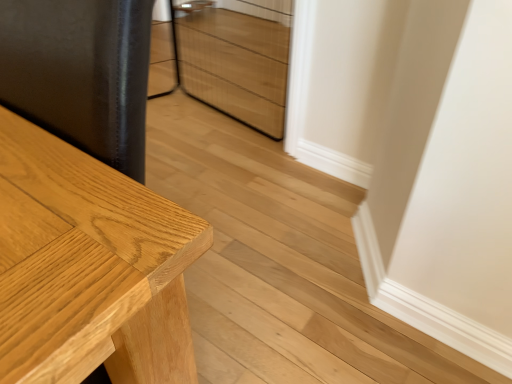
Identify the location of free spot below wooden drawer at center (from a real-world perspective). The width and height of the screenshot is (512, 384). (231, 119).